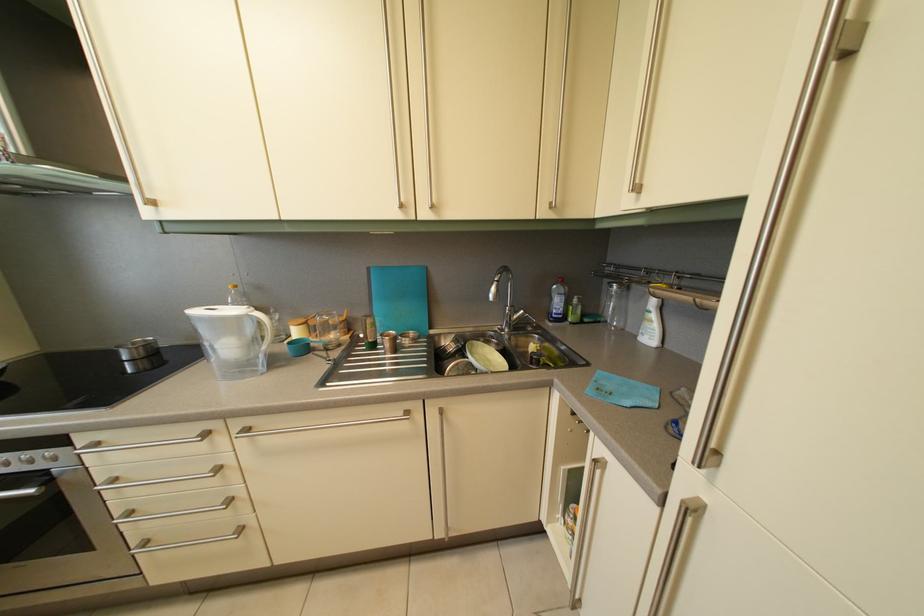
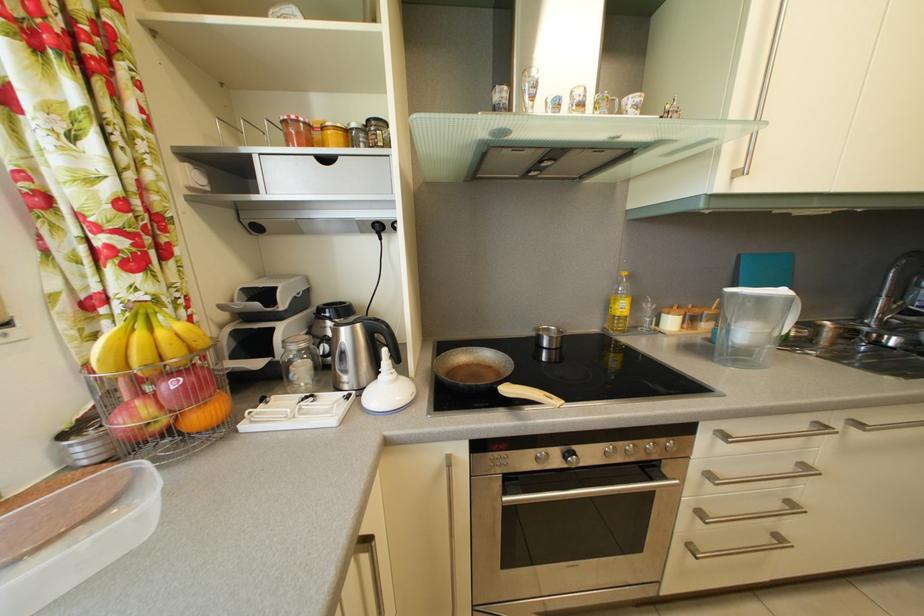
Question: What movement of the cameraman would produce the second image?

Choices:
 (A) Left
 (B) Right
 (C) Forward
 (D) Backward

Answer: (A)